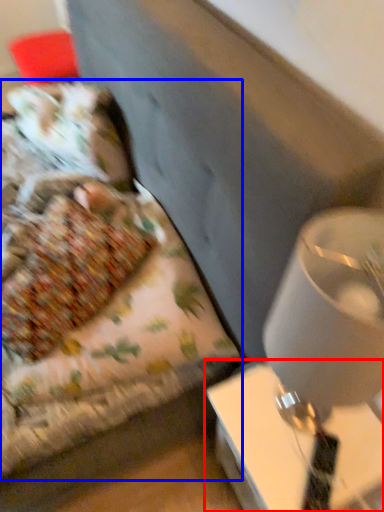
Question: Which point is further to the camera, table (highlighted by a red box) or bed (highlighted by a blue box)?

Choices:
 (A) table
 (B) bed

Answer: (B)